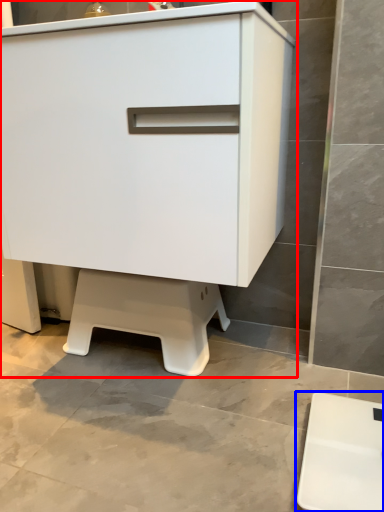
Question: Which point is further to the camera, chest of drawers (highlighted by a red box) or furniture (highlighted by a blue box)?

Choices:
 (A) chest of drawers
 (B) furniture

Answer: (A)